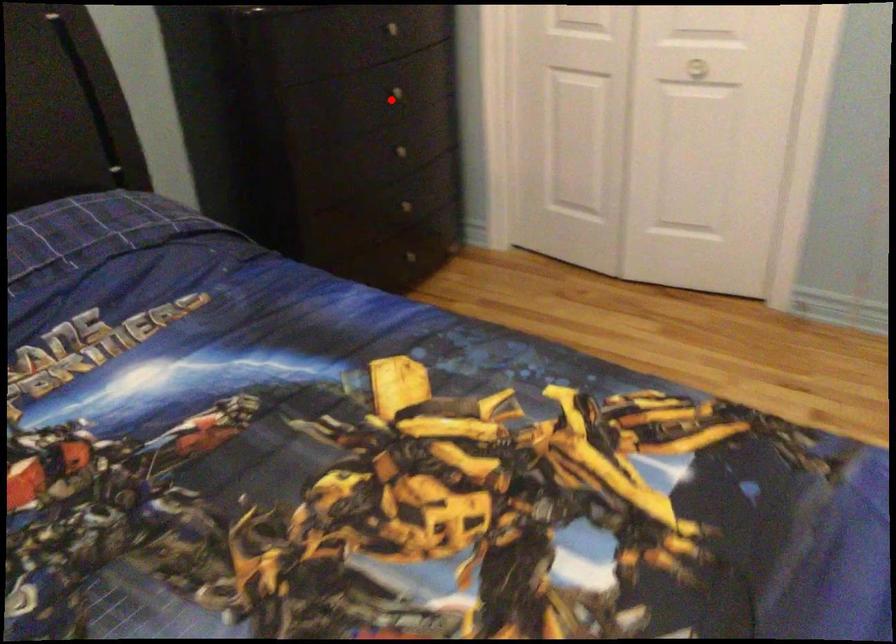
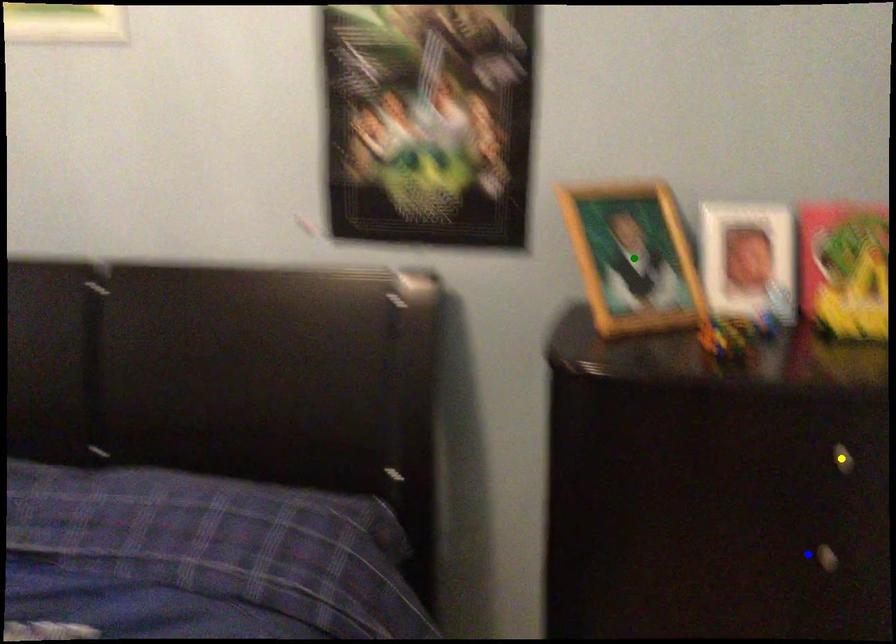
Question: I am providing you with two images of the same scene from different viewpoints. A red point is marked on the first image. You are given multiple points on the second image. Which point in image 2 is actually the same real-world point as the red point in image 1?

Choices:
 (A) yellow point
 (B) green point
 (C) blue point

Answer: (C)